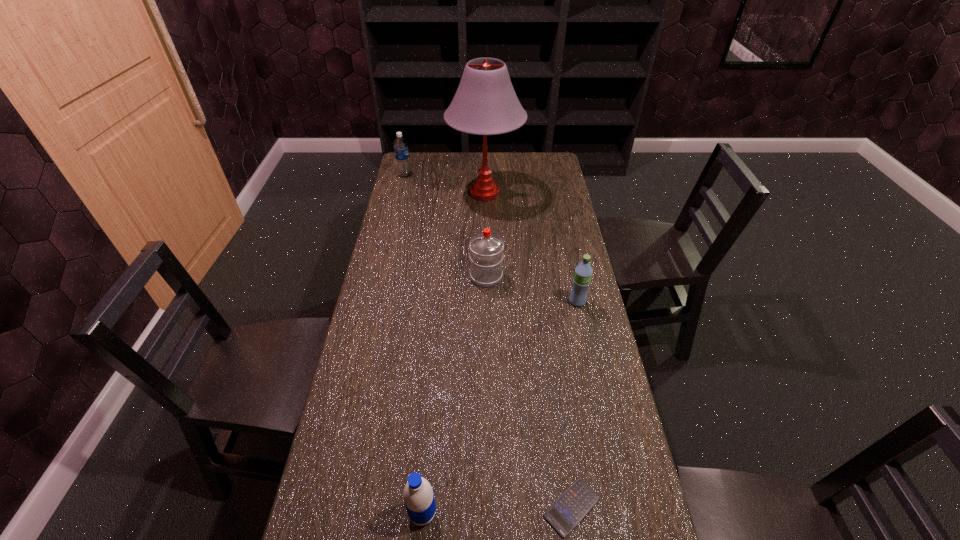
This screenshot has height=540, width=960. Find the location of `water bottle positioned at the far edge`. water bottle positioned at the far edge is located at coordinates (400, 145).

Locate an element on the screen. The height and width of the screenshot is (540, 960). object located in the left edge section of the desktop is located at coordinates (400, 145).

Where is `water bottle situated at the right edge`? The height and width of the screenshot is (540, 960). water bottle situated at the right edge is located at coordinates (583, 272).

The height and width of the screenshot is (540, 960). In order to click on calculator that is at the right edge in this screenshot , I will do `click(573, 505)`.

The width and height of the screenshot is (960, 540). Identify the location of object located in the far left corner section of the desktop. (400, 145).

At what (x,y) coordinates should I click in order to perform the action: click on vacant space at the far edge. Please return your answer as a coordinate pair (x, y). Looking at the image, I should click on (463, 178).

The width and height of the screenshot is (960, 540). In order to click on free location at the left edge in this screenshot , I will do `click(384, 358)`.

In the image, there is a desktop. Identify the location of vacant space at the right edge. Image resolution: width=960 pixels, height=540 pixels. (555, 269).

Find the location of a particular element. vacant space at the far left corner is located at coordinates (414, 173).

Image resolution: width=960 pixels, height=540 pixels. Find the location of `free space at the far right corner of the desktop`. free space at the far right corner of the desktop is located at coordinates (528, 160).